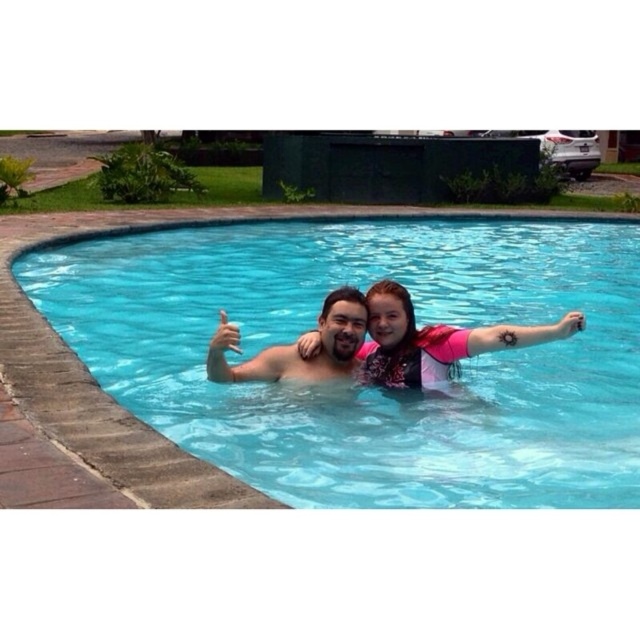
Is clear blue water at center further to camera compared to pink neoprene swimsuit at center?

That is False.

Where is `clear blue water at center`? Image resolution: width=640 pixels, height=640 pixels. clear blue water at center is located at coordinates (365, 387).

Which is behind, point (496, 272) or point (364, 362)?

The point (496, 272) is behind.

This screenshot has height=640, width=640. What are the coordinates of `clear blue water at center` in the screenshot? It's located at (365, 387).